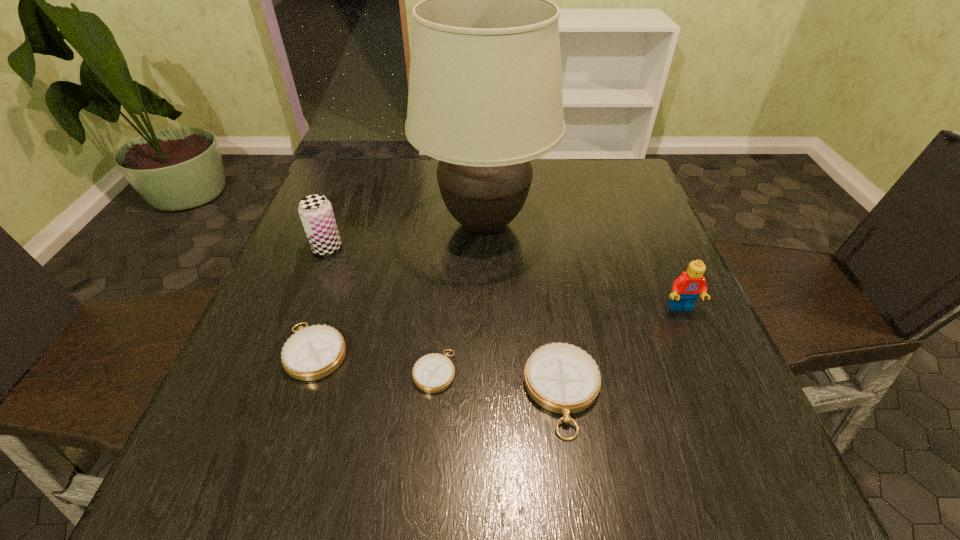
This screenshot has height=540, width=960. Find the location of `vacant area that lies between the rightmost compass and the beer can`. vacant area that lies between the rightmost compass and the beer can is located at coordinates (444, 320).

The height and width of the screenshot is (540, 960). What are the coordinates of `vacant point located between the beer can and the rightmost compass` in the screenshot? It's located at (444, 320).

You are a GUI agent. You are given a task and a screenshot of the screen. Output one action in this format:
    pyautogui.click(x=<x>, y=<y>)
    Task: Click on the empty space that is in between the Lego and the rightmost compass
    The width and height of the screenshot is (960, 540).
    Given the screenshot: What is the action you would take?
    pyautogui.click(x=622, y=350)

Identify the location of unoccupied area between the shortest compass and the beer can. (381, 309).

Where is `object that is the second closest to the beer can`? The image size is (960, 540). object that is the second closest to the beer can is located at coordinates (313, 352).

Image resolution: width=960 pixels, height=540 pixels. Identify the location of the closest object to the shortest object. (560, 377).

Locate an element on the screen. The image size is (960, 540). the second closest compass to the rightmost compass is located at coordinates (313, 352).

Identify which compass is the second nearest to the second shortest compass. Please provide its 2D coordinates. Your answer should be formatted as a tuple, i.e. [(x, y)], where the tuple contains the x and y coordinates of a point satisfying the conditions above.

[(560, 377)]

Locate an element on the screen. The width and height of the screenshot is (960, 540). vacant space that satisfies the following two spatial constraints: 1. on the front side of the beer can; 2. on the left side of the second shortest compass is located at coordinates (287, 351).

Identify the location of vacant region that satisfies the following two spatial constraints: 1. on the front side of the second tallest compass; 2. on the left side of the beer can. (287, 351).